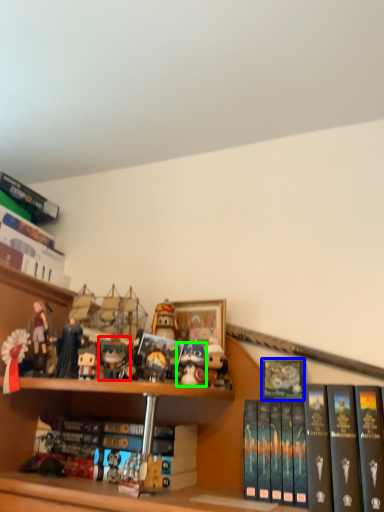
Question: Considering the real-world distances, which object is farthest from toy (highlighted by a red box)? book (highlighted by a blue box) or toy (highlighted by a green box)?

Choices:
 (A) book
 (B) toy

Answer: (A)